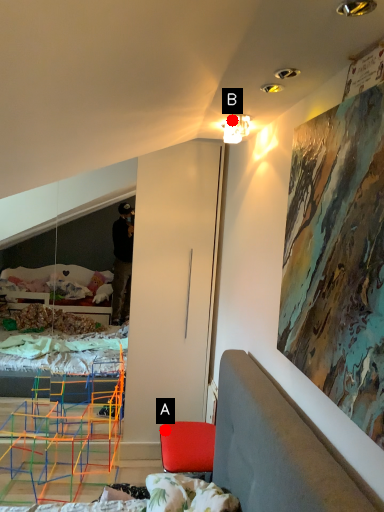
Question: Two points are circled on the image, labeled by A and B beside each circle. Which point appears farthest from the camera in this image?

Choices:
 (A) A is further
 (B) B is further

Answer: (A)